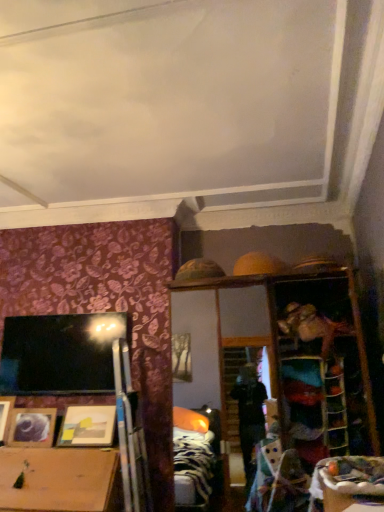
Question: Can you confirm if matte wooden picture frame at lower left, arranged as the first picture frame when viewed from the right, is taller than wooden table at lower right?

Choices:
 (A) no
 (B) yes

Answer: (B)

Question: Considering the relative positions of matte wooden picture frame at lower left, arranged as the first picture frame when viewed from the right, and wooden table at lower right in the image provided, is matte wooden picture frame at lower left, arranged as the first picture frame when viewed from the right, to the right of wooden table at lower right from the viewer's perspective?

Choices:
 (A) yes
 (B) no

Answer: (B)

Question: Is matte wooden picture frame at lower left, arranged as the first picture frame when viewed from the right, next to wooden table at lower right and touching it?

Choices:
 (A) yes
 (B) no

Answer: (B)

Question: From the image's perspective, would you say matte wooden picture frame at lower left, arranged as the first picture frame when viewed from the right, is positioned over wooden table at lower right?

Choices:
 (A) no
 (B) yes

Answer: (A)

Question: Does matte wooden picture frame at lower left, arranged as the 3th picture frame when viewed from the left, have a lesser height compared to wooden table at lower right?

Choices:
 (A) yes
 (B) no

Answer: (B)

Question: In terms of size, does wooden table at lower right appear bigger or smaller than matte wooden picture frame at lower left, arranged as the 3th picture frame when viewed from the left?

Choices:
 (A) small
 (B) big

Answer: (A)

Question: Looking at their shapes, would you say wooden table at lower right is wider or thinner than matte wooden picture frame at lower left, arranged as the 3th picture frame when viewed from the left?

Choices:
 (A) thin
 (B) wide

Answer: (B)

Question: Do you think wooden table at lower right is within matte wooden picture frame at lower left, arranged as the 3th picture frame when viewed from the left, or outside of it?

Choices:
 (A) inside
 (B) outside

Answer: (B)

Question: From the image's perspective, is wooden table at lower right positioned above or below matte wooden picture frame at lower left, arranged as the first picture frame when viewed from the right?

Choices:
 (A) below
 (B) above

Answer: (B)

Question: Would you say wooden picture frame at lower left, positioned as the first picture frame in left-to-right order, is to the left or to the right of matte wooden picture frame at lower left, which ranks as the second picture frame in left-to-right order, in the picture?

Choices:
 (A) left
 (B) right

Answer: (A)

Question: From a real-world perspective, is wooden picture frame at lower left, arranged as the third picture frame when viewed from the right, positioned above or below matte wooden picture frame at lower left, arranged as the second picture frame when viewed from the right?

Choices:
 (A) below
 (B) above

Answer: (B)

Question: Is wooden picture frame at lower left, arranged as the third picture frame when viewed from the right, wider or thinner than matte wooden picture frame at lower left, which ranks as the second picture frame in left-to-right order?

Choices:
 (A) wide
 (B) thin

Answer: (A)

Question: Is wooden picture frame at lower left, positioned as the first picture frame in left-to-right order, in front of or behind matte wooden picture frame at lower left, arranged as the second picture frame when viewed from the right, in the image?

Choices:
 (A) front
 (B) behind

Answer: (B)

Question: Looking at their shapes, would you say wooden picture frame at lower left, positioned as the first picture frame in left-to-right order, is wider or thinner than matte wooden picture frame at lower left, arranged as the first picture frame when viewed from the right?

Choices:
 (A) thin
 (B) wide

Answer: (A)

Question: Is wooden picture frame at lower left, positioned as the first picture frame in left-to-right order, bigger or smaller than matte wooden picture frame at lower left, arranged as the 3th picture frame when viewed from the left?

Choices:
 (A) big
 (B) small

Answer: (B)